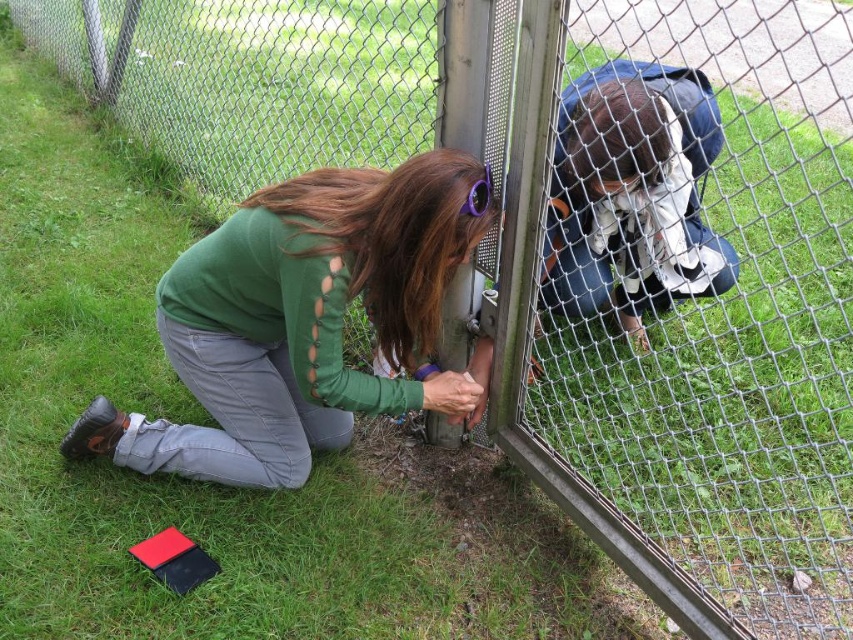
Is green matte shirt at lower left bigger than denim jacket at upper center?

Incorrect, green matte shirt at lower left is not larger than denim jacket at upper center.

Locate an element on the screen. The height and width of the screenshot is (640, 853). green matte shirt at lower left is located at coordinates (300, 321).

Does denim jacket at upper center have a larger size compared to purple plastic goggles at center?

Correct, denim jacket at upper center is larger in size than purple plastic goggles at center.

Between denim jacket at upper center and purple plastic goggles at center, which one appears on the left side from the viewer's perspective?

Positioned to the left is purple plastic goggles at center.

Is point (669, 253) positioned in front of point (469, 188)?

No, it is not.

Identify the location of denim jacket at upper center. (631, 195).

Is green matte shirt at lower left to the left of purple plastic goggles at center from the viewer's perspective?

Yes, green matte shirt at lower left is to the left of purple plastic goggles at center.

This screenshot has width=853, height=640. What do you see at coordinates (300, 321) in the screenshot?
I see `green matte shirt at lower left` at bounding box center [300, 321].

At what (x,y) coordinates should I click in order to perform the action: click on green matte shirt at lower left. Please return your answer as a coordinate pair (x, y). Looking at the image, I should click on (300, 321).